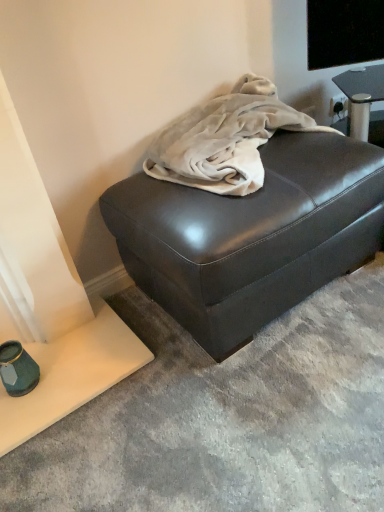
Locate an element on the screen. This screenshot has width=384, height=512. matte black ottoman at center is located at coordinates (251, 234).

Describe the element at coordinates (251, 234) in the screenshot. I see `matte black ottoman at center` at that location.

This screenshot has height=512, width=384. In order to click on matte black ottoman at center in this screenshot , I will do `click(251, 234)`.